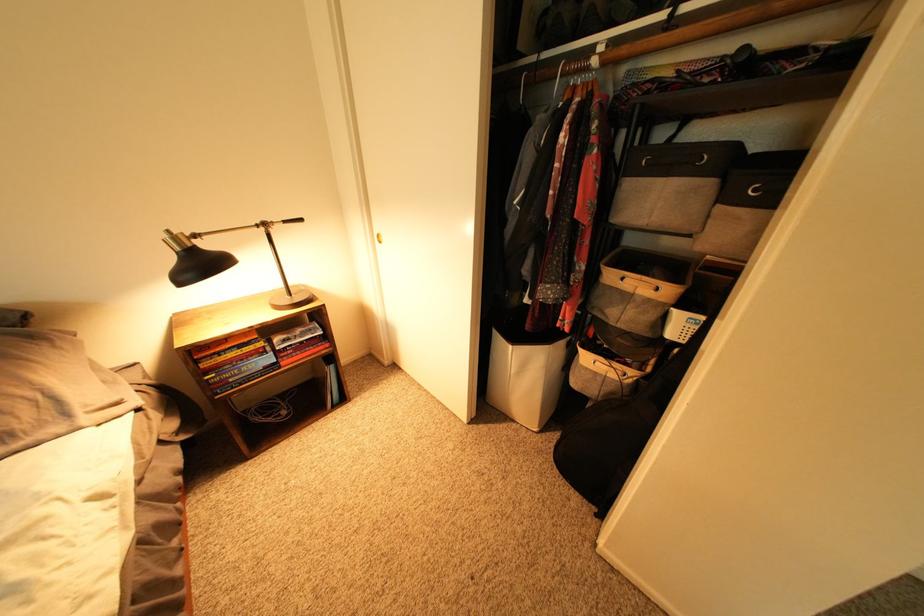
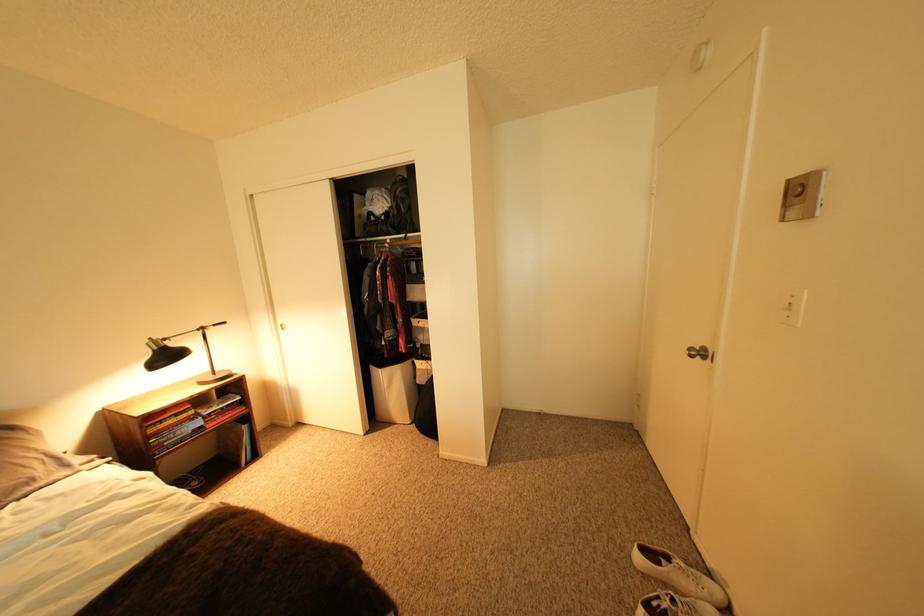
Find the pixel in the second image that matches pixel 523 347 in the first image.

(393, 371)